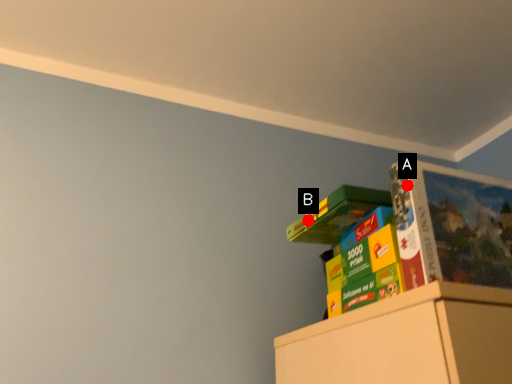
Question: Two points are circled on the image, labeled by A and B beside each circle. Which point is closer to the camera taking this photo?

Choices:
 (A) A is closer
 (B) B is closer

Answer: (A)